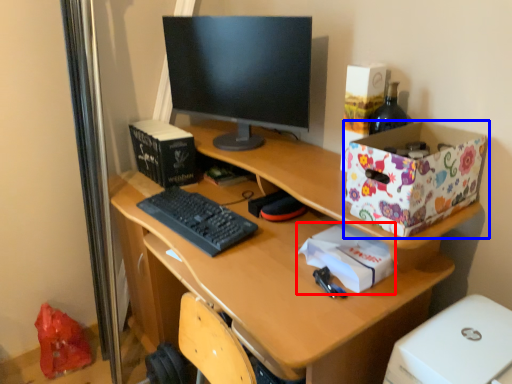
Question: Which of the following is the closest to the observer, package (highlighted by a red box) or storage box (highlighted by a blue box)?

Choices:
 (A) package
 (B) storage box

Answer: (B)